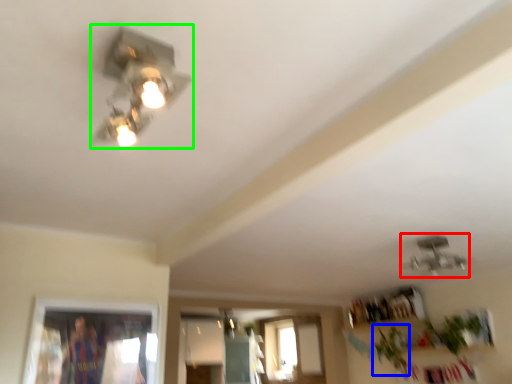
Question: Based on their relative distances, which object is nearer to lamp (highlighted by a red box)? Choose from plant (highlighted by a blue box) and lamp (highlighted by a green box).

Choices:
 (A) plant
 (B) lamp

Answer: (A)